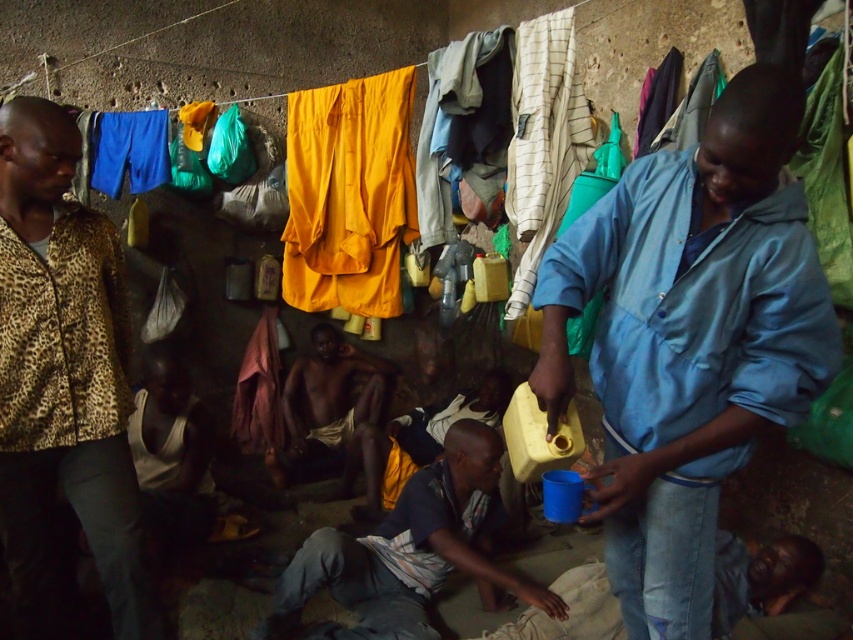
Is point (529, 595) less distant than point (329, 429)?

Yes, it is.

Measure the distance between point (437,500) and camera.

A distance of 2.75 meters exists between point (437,500) and camera.

What do you see at coordinates (412, 552) in the screenshot?
I see `dark blue striped shirt at center` at bounding box center [412, 552].

In order to click on dark blue striped shirt at center in this screenshot , I will do `click(412, 552)`.

Is blue satin shirt at right shorter than dark skin man at center?

Incorrect, blue satin shirt at right's height does not fall short of dark skin man at center's.

Does blue satin shirt at right have a larger size compared to dark skin man at center?

Indeed, blue satin shirt at right has a larger size compared to dark skin man at center.

Describe the element at coordinates (689, 340) in the screenshot. The width and height of the screenshot is (853, 640). I see `blue satin shirt at right` at that location.

Locate an element on the screen. This screenshot has width=853, height=640. blue satin shirt at right is located at coordinates (689, 340).

Between leopard print jacket at left and dark skin man at center, which one is positioned lower?

Positioned lower is dark skin man at center.

Who is taller, leopard print jacket at left or dark skin man at center?

Standing taller between the two is leopard print jacket at left.

Is point (3, 168) positioned before point (369, 388)?

Yes, it is in front of point (369, 388).

Image resolution: width=853 pixels, height=640 pixels. Identify the location of leopard print jacket at left. (62, 380).